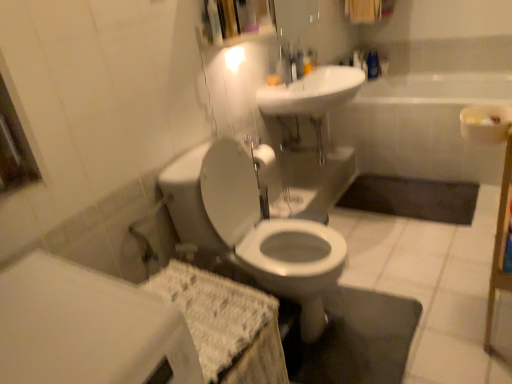
Question: Considering the relative sizes of dark gray rubber bath mat at lower center and white glossy sink at upper center in the image provided, is dark gray rubber bath mat at lower center thinner than white glossy sink at upper center?

Choices:
 (A) yes
 (B) no

Answer: (B)

Question: From a real-world perspective, is dark gray rubber bath mat at lower center below white glossy sink at upper center?

Choices:
 (A) yes
 (B) no

Answer: (A)

Question: Could white glossy sink at upper center be considered to be inside dark gray rubber bath mat at lower center?

Choices:
 (A) yes
 (B) no

Answer: (B)

Question: Is dark gray rubber bath mat at lower center next to white glossy sink at upper center and touching it?

Choices:
 (A) no
 (B) yes

Answer: (A)

Question: Is dark gray rubber bath mat at lower center positioned far away from white glossy sink at upper center?

Choices:
 (A) yes
 (B) no

Answer: (B)

Question: Considering the positions of white glossy sink at upper center and white glossy faucet at upper center in the image, is white glossy sink at upper center bigger or smaller than white glossy faucet at upper center?

Choices:
 (A) big
 (B) small

Answer: (A)

Question: In terms of height, does white glossy sink at upper center look taller or shorter compared to white glossy faucet at upper center?

Choices:
 (A) tall
 (B) short

Answer: (B)

Question: Is white glossy sink at upper center to the left or to the right of white glossy faucet at upper center in the image?

Choices:
 (A) left
 (B) right

Answer: (B)

Question: From the image's perspective, relative to white glossy faucet at upper center, is white glossy sink at upper center above or below?

Choices:
 (A) above
 (B) below

Answer: (B)

Question: From the image's perspective, is white glossy toilet at center above or below white glossy faucet at upper center?

Choices:
 (A) above
 (B) below

Answer: (B)

Question: Looking at the image, does white glossy toilet at center seem bigger or smaller compared to white glossy faucet at upper center?

Choices:
 (A) big
 (B) small

Answer: (A)

Question: From a real-world perspective, is white glossy toilet at center above or below white glossy faucet at upper center?

Choices:
 (A) above
 (B) below

Answer: (B)

Question: In terms of width, does white glossy toilet at center look wider or thinner when compared to white glossy faucet at upper center?

Choices:
 (A) wide
 (B) thin

Answer: (A)

Question: Considering the positions of point (268, 89) and point (256, 279), is point (268, 89) closer or farther from the camera than point (256, 279)?

Choices:
 (A) closer
 (B) farther

Answer: (B)

Question: From a real-world perspective, is white glossy sink at upper center physically located above or below white glossy toilet at center?

Choices:
 (A) below
 (B) above

Answer: (B)